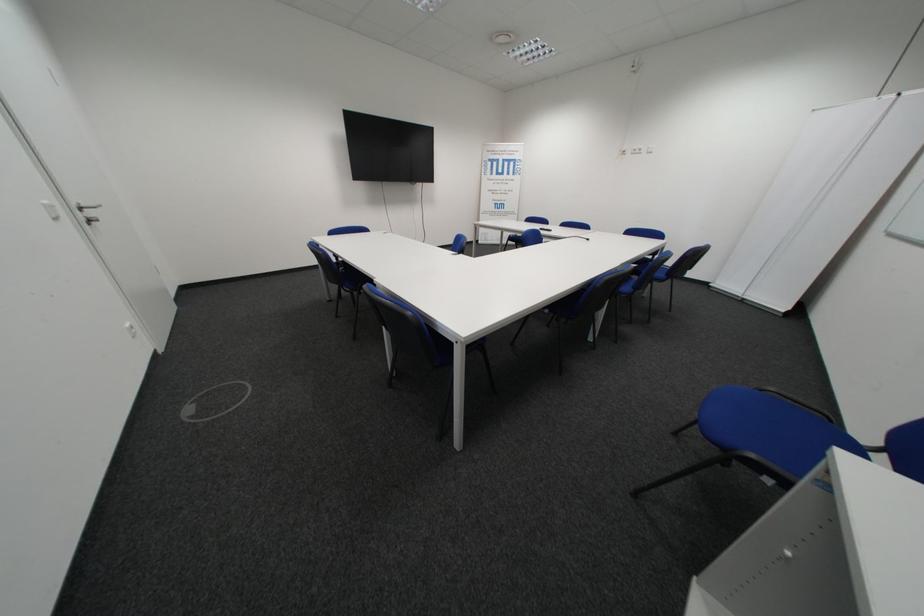
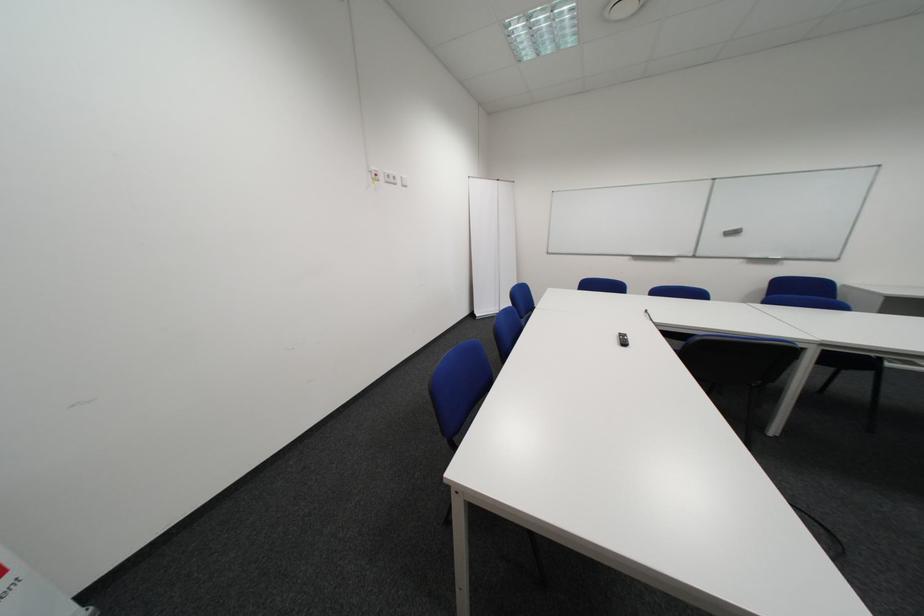
The point at (651, 151) is marked in the first image. Where is the corresponding point in the second image?

(407, 179)